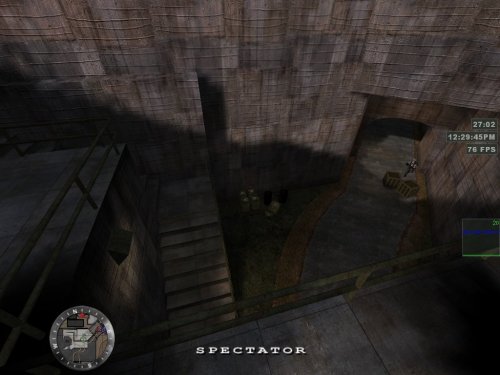
You are a GUI agent. You are given a task and a screenshot of the screen. Output one action in this format:
    pyautogui.click(x=<x>, y=<y>)
    Task: Click on the concrete wall
    This screenshot has height=375, width=500.
    Given the screenshot: What is the action you would take?
    pyautogui.click(x=165, y=44)